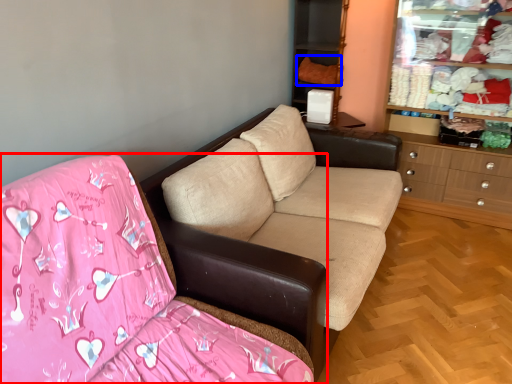
Question: Which object appears closest to the camera in this image, studio couch (highlighted by a red box) or clothing (highlighted by a blue box)?

Choices:
 (A) studio couch
 (B) clothing

Answer: (A)